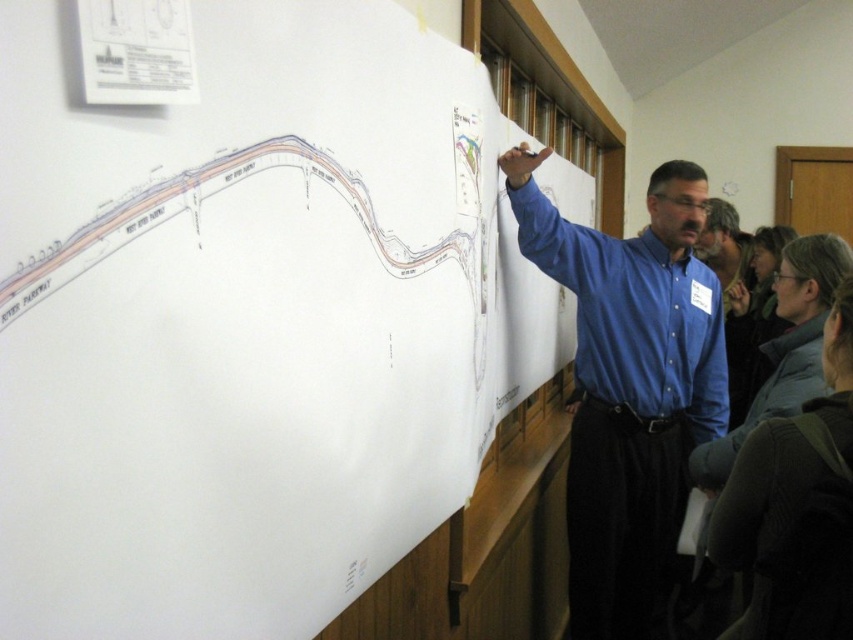
You are standing in front of the whiteboard and want to touch the point labeled as point (x=1, y=513) on the whiteboard. If your hand can reach up to 22 inches from your body, can you reach that point?

The point (x=1, y=513) is 22.13 inches away from the viewer. Since your hand can reach up to 22 inches, you cannot quite reach the point as it is slightly farther than your reach.